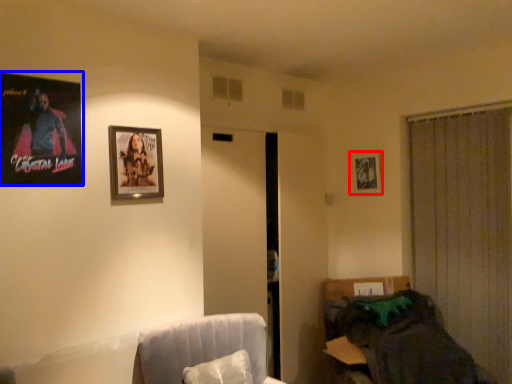
Question: Which object is further to the camera taking this photo, picture frame (highlighted by a red box) or picture frame (highlighted by a blue box)?

Choices:
 (A) picture frame
 (B) picture frame

Answer: (A)